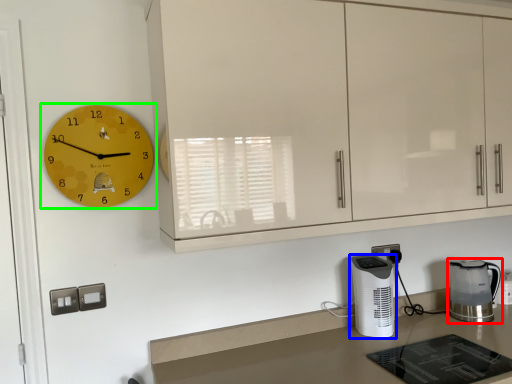
Question: Based on their relative distances, which object is nearer to home appliance (highlighted by a red box)? Choose from home appliance (highlighted by a blue box) and wall clock (highlighted by a green box).

Choices:
 (A) home appliance
 (B) wall clock

Answer: (A)